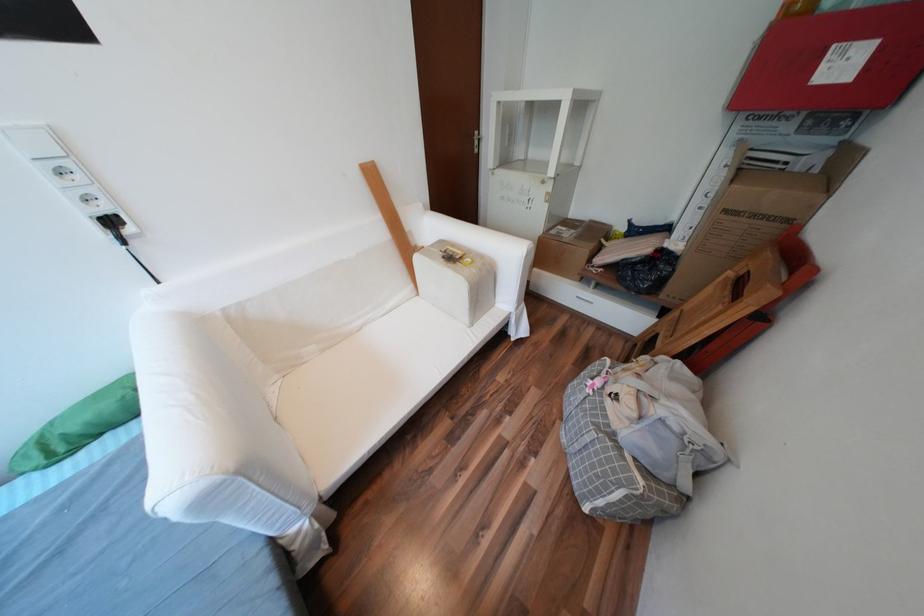
I want to click on brown cardboard box, so click(754, 215).